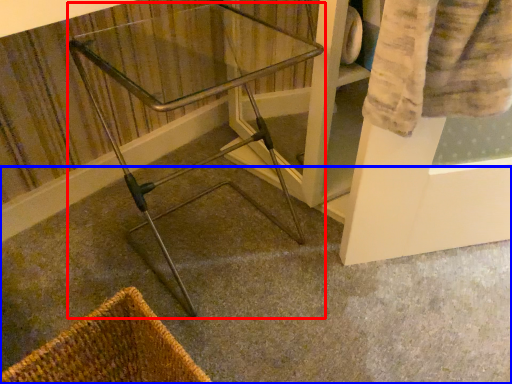
Question: Which point is closer to the camera, furniture (highlighted by a red box) or concrete (highlighted by a blue box)?

Choices:
 (A) furniture
 (B) concrete

Answer: (B)